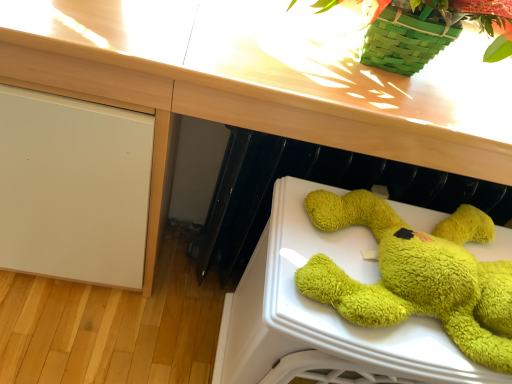
You are a GUI agent. You are given a task and a screenshot of the screen. Output one action in this format:
    pyautogui.click(x=<x>, y=<y>)
    Task: Click on the green fuzzy stuffed animal at lower right
    The height and width of the screenshot is (384, 512).
    Given the screenshot: What is the action you would take?
    tap(417, 275)

Describe the element at coordinates (417, 275) in the screenshot. I see `green fuzzy stuffed animal at lower right` at that location.

Locate an element on the screen. This screenshot has width=512, height=384. wooden at upper center is located at coordinates (266, 79).

What is the approximate width of wooden at upper center?

It is 15.20 inches.

Image resolution: width=512 pixels, height=384 pixels. Describe the element at coordinates (266, 79) in the screenshot. I see `wooden at upper center` at that location.

The height and width of the screenshot is (384, 512). I want to click on green fuzzy stuffed animal at lower right, so click(417, 275).

Does wooden at upper center appear on the right side of green fuzzy stuffed animal at lower right?

Incorrect, wooden at upper center is not on the right side of green fuzzy stuffed animal at lower right.

Which object is further away from the camera, wooden at upper center or green fuzzy stuffed animal at lower right?

wooden at upper center is more distant.

Is point (353, 81) closer to camera compared to point (466, 272)?

That is False.

From the image's perspective, is wooden at upper center positioned above or below green fuzzy stuffed animal at lower right?

Based on their image positions, wooden at upper center is located above green fuzzy stuffed animal at lower right.

Looking at this image, from a real-world perspective, relative to green fuzzy stuffed animal at lower right, is wooden at upper center vertically above or below?

In terms of real-world spatial position, wooden at upper center is above green fuzzy stuffed animal at lower right.

Which of these two, wooden at upper center or green fuzzy stuffed animal at lower right, is thinner?

Thinner between the two is green fuzzy stuffed animal at lower right.

Is wooden at upper center shorter than green fuzzy stuffed animal at lower right?

No, wooden at upper center is not shorter than green fuzzy stuffed animal at lower right.

Can you confirm if wooden at upper center is smaller than green fuzzy stuffed animal at lower right?

No, wooden at upper center is not smaller than green fuzzy stuffed animal at lower right.

Choose the correct answer: Is wooden at upper center inside green fuzzy stuffed animal at lower right or outside it?

wooden at upper center is outside green fuzzy stuffed animal at lower right.

Is wooden at upper center far away from green fuzzy stuffed animal at lower right?

No, wooden at upper center is not far from green fuzzy stuffed animal at lower right.

Is wooden at upper center oriented towards green fuzzy stuffed animal at lower right?

No, wooden at upper center is not facing towards green fuzzy stuffed animal at lower right.

How many degrees apart are the facing directions of wooden at upper center and green fuzzy stuffed animal at lower right?

The angle between the facing direction of wooden at upper center and the facing direction of green fuzzy stuffed animal at lower right is 2.72 degrees.

The height and width of the screenshot is (384, 512). Find the location of `toy located underneath the wooden at upper center (from a real-world perspective)`. toy located underneath the wooden at upper center (from a real-world perspective) is located at coordinates click(x=417, y=275).

Considering the relative positions of green fuzzy stuffed animal at lower right and wooden at upper center in the image provided, is green fuzzy stuffed animal at lower right to the left or to the right of wooden at upper center?

green fuzzy stuffed animal at lower right is positioned on wooden at upper center's right side.

Considering the relative positions of green fuzzy stuffed animal at lower right and wooden at upper center in the image provided, is green fuzzy stuffed animal at lower right behind wooden at upper center?

That is False.

Which point is more forward, (389, 298) or (511, 129)?

The point (389, 298) is closer to the camera.

From the image's perspective, is green fuzzy stuffed animal at lower right on top of wooden at upper center?

No, from the image's perspective, green fuzzy stuffed animal at lower right is not on top of wooden at upper center.

From a real-world perspective, does green fuzzy stuffed animal at lower right sit lower than wooden at upper center?

Correct, in the physical world, green fuzzy stuffed animal at lower right is lower than wooden at upper center.

In the scene shown: Considering the relative sizes of green fuzzy stuffed animal at lower right and wooden at upper center in the image provided, is green fuzzy stuffed animal at lower right wider than wooden at upper center?

Incorrect, the width of green fuzzy stuffed animal at lower right does not surpass that of wooden at upper center.

Considering the sizes of green fuzzy stuffed animal at lower right and wooden at upper center in the image, is green fuzzy stuffed animal at lower right taller or shorter than wooden at upper center?

Considering their sizes, green fuzzy stuffed animal at lower right has less height than wooden at upper center.

Considering the relative sizes of green fuzzy stuffed animal at lower right and wooden at upper center in the image provided, is green fuzzy stuffed animal at lower right bigger than wooden at upper center?

No, green fuzzy stuffed animal at lower right is not bigger than wooden at upper center.

Could wooden at upper center be considered to be inside green fuzzy stuffed animal at lower right?

That's incorrect, wooden at upper center is not inside green fuzzy stuffed animal at lower right.

Is green fuzzy stuffed animal at lower right far from wooden at upper center?

green fuzzy stuffed animal at lower right is actually quite close to wooden at upper center.

Does green fuzzy stuffed animal at lower right turn towards wooden at upper center?

No, green fuzzy stuffed animal at lower right does not turn towards wooden at upper center.

How different are the orientations of green fuzzy stuffed animal at lower right and wooden at upper center in degrees?

The angle between the facing direction of green fuzzy stuffed animal at lower right and the facing direction of wooden at upper center is 2.72 degrees.

This screenshot has height=384, width=512. I want to click on toy in front of the wooden at upper center, so [x=417, y=275].

At what (x,y) coordinates should I click in order to perform the action: click on counter top behind the green fuzzy stuffed animal at lower right. Please return your answer as a coordinate pair (x, y). Looking at the image, I should click on (266, 79).

Find the location of a particular element. counter top on the left of green fuzzy stuffed animal at lower right is located at coordinates (266, 79).